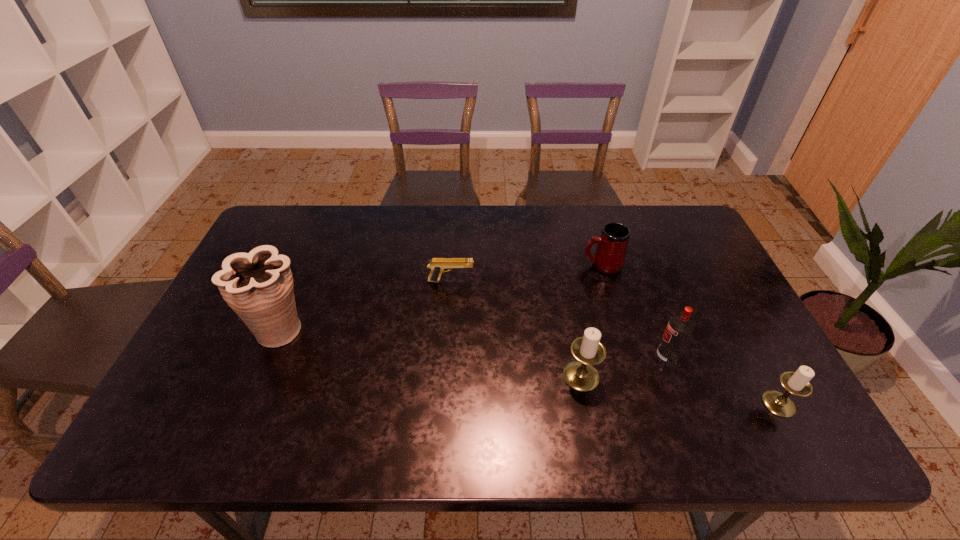
The width and height of the screenshot is (960, 540). Find the location of `blank space located 0.220m at the barrel of the pistol`. blank space located 0.220m at the barrel of the pistol is located at coordinates point(548,281).

In order to click on object that is at the left edge in this screenshot , I will do `click(258, 286)`.

Find the location of a particular element. object at the right edge is located at coordinates (797, 383).

Where is `object at the near right corner`? object at the near right corner is located at coordinates (797, 383).

The width and height of the screenshot is (960, 540). In order to click on free space at the far edge of the desktop in this screenshot , I will do `click(507, 212)`.

Find the location of a particular element. The width and height of the screenshot is (960, 540). free space at the near edge of the desktop is located at coordinates click(636, 408).

At what (x,y) coordinates should I click in order to perform the action: click on free space at the left edge of the desktop. Please return your answer as a coordinate pair (x, y). This screenshot has width=960, height=540. Looking at the image, I should click on (209, 345).

In the image, there is a desktop. Where is `vacant area at the right edge`? The image size is (960, 540). vacant area at the right edge is located at coordinates (696, 276).

In the image, there is a desktop. Identify the location of vacant space at the far right corner. The width and height of the screenshot is (960, 540). (695, 246).

Identify the location of vacant space at the near right corner of the desktop. (767, 383).